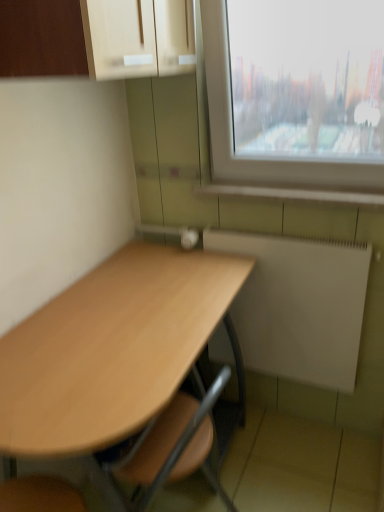
Image resolution: width=384 pixels, height=512 pixels. What do you see at coordinates (290, 194) in the screenshot?
I see `white tile at lower right` at bounding box center [290, 194].

You are a GUI agent. You are given a task and a screenshot of the screen. Output one action in this format:
    pyautogui.click(x=<x>, y=<y>)
    Task: Click on the light brown wood desk at center
    
    Given the screenshot: What is the action you would take?
    pyautogui.click(x=121, y=368)

Locate an element on the screen. white matte radiator at lower right is located at coordinates (299, 307).

Locate an element on the screen. This screenshot has width=384, height=512. matte wood cabinet at upper left is located at coordinates (103, 37).

Is point (244, 335) positioned before point (341, 204)?

No, it is not.

Is white matte radiator at lower right positioned with its back to white tile at lower right?

white matte radiator at lower right is not turned away from white tile at lower right.

Is white matte radiator at lower right not close to white tile at lower right?

No, white matte radiator at lower right is in close proximity to white tile at lower right.

From the image's perspective, between matte wood cabinet at upper left and light brown wood desk at center, which one is located above?

matte wood cabinet at upper left.

Is matte wood cabinet at upper left oriented away from light brown wood desk at center?

matte wood cabinet at upper left does not have its back to light brown wood desk at center.

Can you confirm if matte wood cabinet at upper left is bigger than light brown wood desk at center?

Actually, matte wood cabinet at upper left might be smaller than light brown wood desk at center.

In the scene shown: How many degrees apart are the facing directions of matte wood cabinet at upper left and light brown wood desk at center?

The angular difference between matte wood cabinet at upper left and light brown wood desk at center is 180 degrees.

Based on their positions, is white tile at lower right located to the left or right of matte wood cabinet at upper left?

white tile at lower right is to the right of matte wood cabinet at upper left.

Considering the sizes of objects white tile at lower right and matte wood cabinet at upper left in the image provided, who is wider, white tile at lower right or matte wood cabinet at upper left?

matte wood cabinet at upper left.

Does point (198, 193) lie behind point (97, 51)?

Yes.

From the image's perspective, which one is positioned lower, white tile at lower right or matte wood cabinet at upper left?

white tile at lower right, from the image's perspective.

Is point (343, 197) less distant than point (58, 342)?

That is False.

From a real-world perspective, is white tile at lower right physically located above or below light brown wood desk at center?

From a real-world perspective, white tile at lower right is physically above light brown wood desk at center.

Is light brown wood desk at center inside white tile at lower right?

Definitely not — light brown wood desk at center is not inside white tile at lower right.

Considering the relative sizes of white tile at lower right and light brown wood desk at center in the image provided, is white tile at lower right bigger than light brown wood desk at center?

Actually, white tile at lower right might be smaller than light brown wood desk at center.

How much distance is there between light brown wood desk at center and white tile at lower right?

They are 25.13 inches apart.

Between light brown wood desk at center and white tile at lower right, which one appears on the right side from the viewer's perspective?

Positioned to the right is white tile at lower right.

Is white tile at lower right inside light brown wood desk at center?

That's incorrect, white tile at lower right is not inside light brown wood desk at center.

Looking at this image, does light brown wood desk at center have a larger size compared to white tile at lower right?

Yes, light brown wood desk at center is bigger than white tile at lower right.

Would you say light brown wood desk at center is to the left or to the right of white matte radiator at lower right in the picture?

light brown wood desk at center is to the left of white matte radiator at lower right.

Is light brown wood desk at center oriented away from white matte radiator at lower right?

Yes, light brown wood desk at center is facing away from white matte radiator at lower right.

Is white matte radiator at lower right located within light brown wood desk at center?

Definitely not — white matte radiator at lower right is not inside light brown wood desk at center.

Between light brown wood desk at center and white matte radiator at lower right, which one has less height?

With less height is white matte radiator at lower right.

Is white matte radiator at lower right next to matte wood cabinet at upper left and touching it?

No.

Which object is further away from the camera, white matte radiator at lower right or matte wood cabinet at upper left?

white matte radiator at lower right is more distant.

Who is taller, white matte radiator at lower right or matte wood cabinet at upper left?

Standing taller between the two is white matte radiator at lower right.

Locate an element on the screen. The height and width of the screenshot is (512, 384). window sill that appears on the left of white matte radiator at lower right is located at coordinates (290, 194).

Where is `desk below the matte wood cabinet at upper left (from the image's perspective)`? The height and width of the screenshot is (512, 384). desk below the matte wood cabinet at upper left (from the image's perspective) is located at coordinates (121, 368).

When comparing their distances from white tile at lower right, does matte wood cabinet at upper left or light brown wood desk at center seem closer?

Based on the image, light brown wood desk at center appears to be nearer to white tile at lower right.

Looking at the image, which one is located closer to white tile at lower right, light brown wood desk at center or white matte radiator at lower right?

Among the two, white matte radiator at lower right is located nearer to white tile at lower right.

When comparing their distances from white matte radiator at lower right, does light brown wood desk at center or matte wood cabinet at upper left seem closer?

light brown wood desk at center is positioned closer to the anchor white matte radiator at lower right.

When comparing their distances from light brown wood desk at center, does matte wood cabinet at upper left or white tile at lower right seem closer?

The object closer to light brown wood desk at center is white tile at lower right.

Based on their spatial positions, is matte wood cabinet at upper left or light brown wood desk at center closer to white matte radiator at lower right?

The object closer to white matte radiator at lower right is light brown wood desk at center.

Based on their spatial positions, is matte wood cabinet at upper left or white matte radiator at lower right closer to white tile at lower right?

Based on the image, white matte radiator at lower right appears to be nearer to white tile at lower right.

Estimate the real-world distances between objects in this image. Which object is further from light brown wood desk at center, white matte radiator at lower right or matte wood cabinet at upper left?

The object further to light brown wood desk at center is matte wood cabinet at upper left.

Which object lies further to the anchor point white tile at lower right, light brown wood desk at center or matte wood cabinet at upper left?

matte wood cabinet at upper left is positioned further to the anchor white tile at lower right.

Find the location of a particular element. radiator between white tile at lower right and light brown wood desk at center in the vertical direction is located at coordinates coord(299,307).

Identify the location of window sill between matte wood cabinet at upper left and white matte radiator at lower right from top to bottom. (290, 194).

In order to click on window sill between matte wood cabinet at upper left and light brown wood desk at center from top to bottom in this screenshot , I will do `click(290, 194)`.

The height and width of the screenshot is (512, 384). Identify the location of radiator between matte wood cabinet at upper left and light brown wood desk at center in the up-down direction. (299, 307).